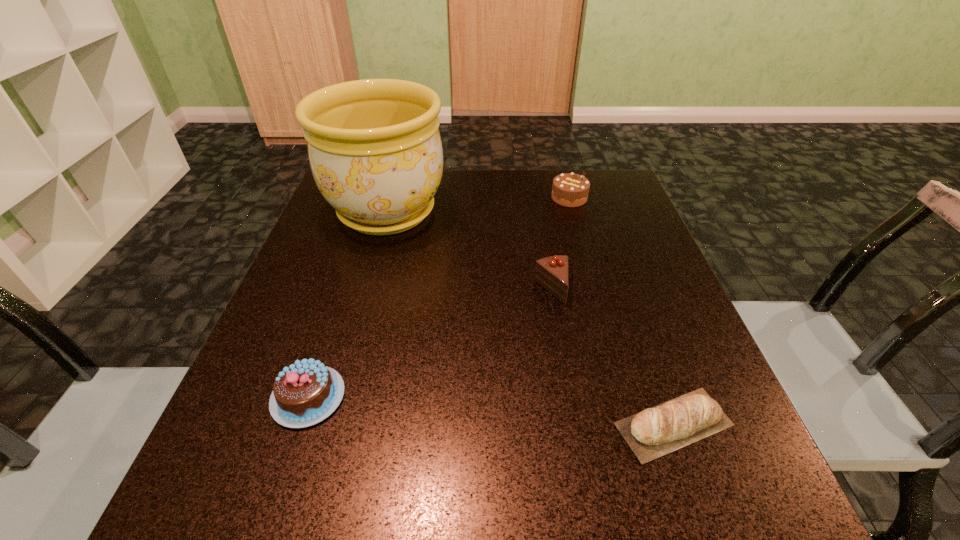
At what (x,y) coordinates should I click in order to perform the action: click on free space located 0.220m on the back of the shortest object. Please return your answer as a coordinate pair (x, y). Looking at the image, I should click on (627, 293).

Where is `flowerpot at the far edge`? flowerpot at the far edge is located at coordinates (375, 151).

The image size is (960, 540). Identify the location of chocolate cake positioned at the far edge. (569, 190).

The width and height of the screenshot is (960, 540). Identify the location of object positioned at the near edge. (696, 414).

What are the coordinates of `flowerpot that is positioned at the left edge` in the screenshot? It's located at (375, 151).

Locate an element on the screen. chocolate cake that is at the left edge is located at coordinates (306, 392).

Image resolution: width=960 pixels, height=540 pixels. What are the coordinates of `chocolate cake located at the right edge` in the screenshot? It's located at (569, 190).

This screenshot has height=540, width=960. I want to click on pita bread at the right edge, so click(696, 414).

At what (x,y) coordinates should I click in order to perform the action: click on object situated at the far left corner. Please return your answer as a coordinate pair (x, y). The height and width of the screenshot is (540, 960). Looking at the image, I should click on (375, 151).

The width and height of the screenshot is (960, 540). Identify the location of object at the far right corner. (569, 190).